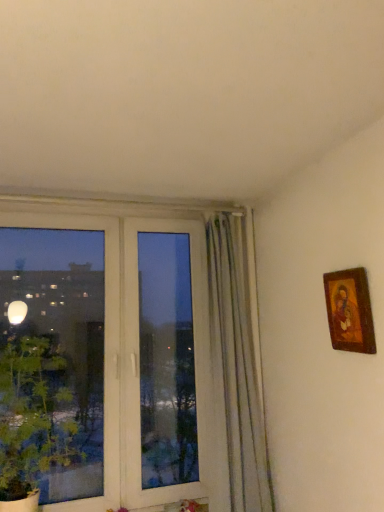
You are a GUI agent. You are given a task and a screenshot of the screen. Output one action in this format:
    pyautogui.click(x=<x>, y=<y>)
    Task: Click on the green leafy plant at left
    This screenshot has width=384, height=512.
    Given the screenshot: What is the action you would take?
    pyautogui.click(x=33, y=416)

Describe the element at coordinates (33, 416) in the screenshot. I see `green leafy plant at left` at that location.

Describe the element at coordinates (349, 311) in the screenshot. This screenshot has width=384, height=512. I see `wooden-framed painting at upper right` at that location.

Locate an element on the screen. wooden-framed painting at upper right is located at coordinates (349, 311).

In order to face wooden-framed painting at upper right, should I rotate leftwards or rightwards?

It's best to rotate right around 19.942 degrees.

I want to click on green leafy plant at left, so click(x=33, y=416).

Which object is positioned more to the left, green leafy plant at left or wooden-framed painting at upper right?

Positioned to the left is green leafy plant at left.

Does green leafy plant at left come in front of wooden-framed painting at upper right?

No, the depth of green leafy plant at left is greater than that of wooden-framed painting at upper right.

Is point (29, 480) positioned before point (345, 291)?

No, (29, 480) is behind (345, 291).

From the image's perspective, which object appears higher, green leafy plant at left or wooden-framed painting at upper right?

wooden-framed painting at upper right is shown above in the image.

From a real-world perspective, between green leafy plant at left and wooden-framed painting at upper right, who is vertically lower?

green leafy plant at left, from a real-world perspective.

Is green leafy plant at left thinner than wooden-framed painting at upper right?

No.

From the picture: Is green leafy plant at left shorter than wooden-framed painting at upper right?

Incorrect, the height of green leafy plant at left does not fall short of that of wooden-framed painting at upper right.

From the picture: Is green leafy plant at left bigger than wooden-framed painting at upper right?

Indeed, green leafy plant at left has a larger size compared to wooden-framed painting at upper right.

Which is correct: green leafy plant at left is inside wooden-framed painting at upper right, or outside of it?

green leafy plant at left is outside wooden-framed painting at upper right.

Is green leafy plant at left positioned far away from wooden-framed painting at upper right?

Indeed, green leafy plant at left is not near wooden-framed painting at upper right.

Is green leafy plant at left looking in the opposite direction of wooden-framed painting at upper right?

No, green leafy plant at left is not facing the opposite direction of wooden-framed painting at upper right.

How many degrees apart are the facing directions of green leafy plant at left and wooden-framed painting at upper right?

The facing directions of green leafy plant at left and wooden-framed painting at upper right are 90.1 degrees apart.

Where is `plant that is behind the wooden-framed painting at upper right`? The image size is (384, 512). plant that is behind the wooden-framed painting at upper right is located at coordinates [33, 416].

Which object is positioned more to the left, wooden-framed painting at upper right or green leafy plant at left?

From the viewer's perspective, green leafy plant at left appears more on the left side.

Does wooden-framed painting at upper right lie behind green leafy plant at left?

No, wooden-framed painting at upper right is closer to the camera.

Considering the points (347, 297) and (25, 456), which point is in front, point (347, 297) or point (25, 456)?

Positioned in front is point (347, 297).

From the image's perspective, is wooden-framed painting at upper right on top of green leafy plant at left?

Yes, from the image's perspective, wooden-framed painting at upper right is on top of green leafy plant at left.

From the picture: From a real-world perspective, between wooden-framed painting at upper right and green leafy plant at left, who is vertically higher?

wooden-framed painting at upper right, from a real-world perspective.

Is wooden-framed painting at upper right thinner than green leafy plant at left?

Correct, the width of wooden-framed painting at upper right is less than that of green leafy plant at left.

Considering the sizes of wooden-framed painting at upper right and green leafy plant at left in the image, is wooden-framed painting at upper right taller or shorter than green leafy plant at left?

In the image, wooden-framed painting at upper right appears to be shorter than green leafy plant at left.

Based on their sizes in the image, would you say wooden-framed painting at upper right is bigger or smaller than green leafy plant at left?

Clearly, wooden-framed painting at upper right is smaller in size than green leafy plant at left.

Is green leafy plant at left located within wooden-framed painting at upper right?

No, green leafy plant at left is not inside wooden-framed painting at upper right.

Would you say wooden-framed painting at upper right is a long distance from green leafy plant at left?

Indeed, wooden-framed painting at upper right is not near green leafy plant at left.

Could you tell me if wooden-framed painting at upper right is turned towards green leafy plant at left?

No, wooden-framed painting at upper right does not turn towards green leafy plant at left.

Can you tell me how much wooden-framed painting at upper right and green leafy plant at left differ in facing direction?

90.1 degrees.

Measure the distance between wooden-framed painting at upper right and green leafy plant at left.

4.48 feet.

Identify the location of picture frame to the right of green leafy plant at left. (349, 311).

Locate an element on the screen. This screenshot has height=512, width=384. picture frame that is above the green leafy plant at left (from the image's perspective) is located at coordinates [349, 311].

Find the location of a particular element. picture frame above the green leafy plant at left (from a real-world perspective) is located at coordinates (349, 311).